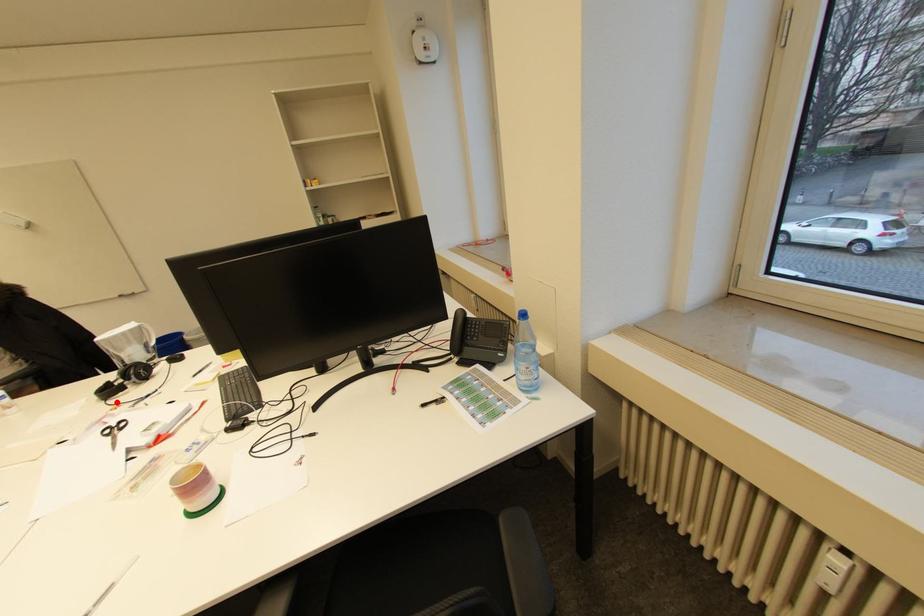
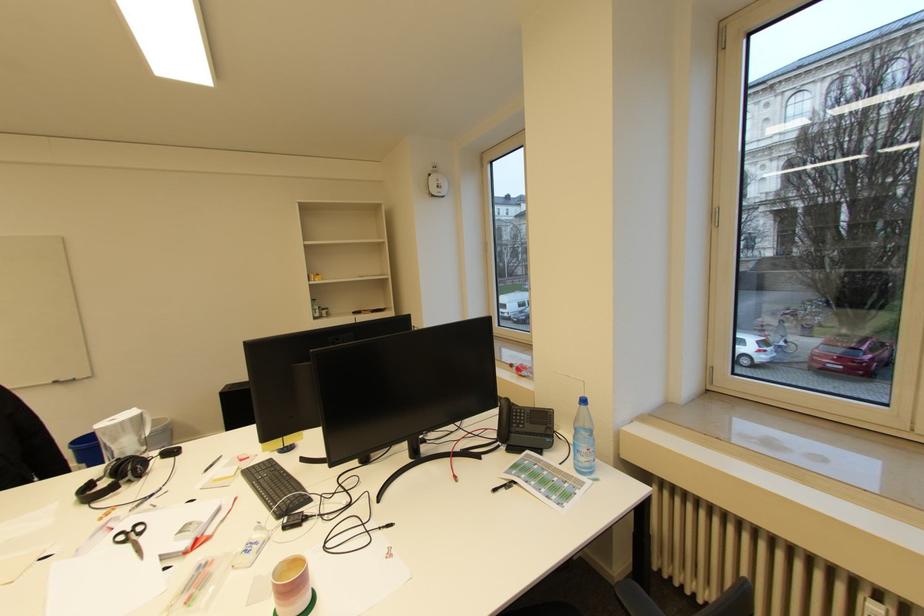
Locate, in the second image, the point that corresponds to the highlighted location in the first image.

(100, 506)